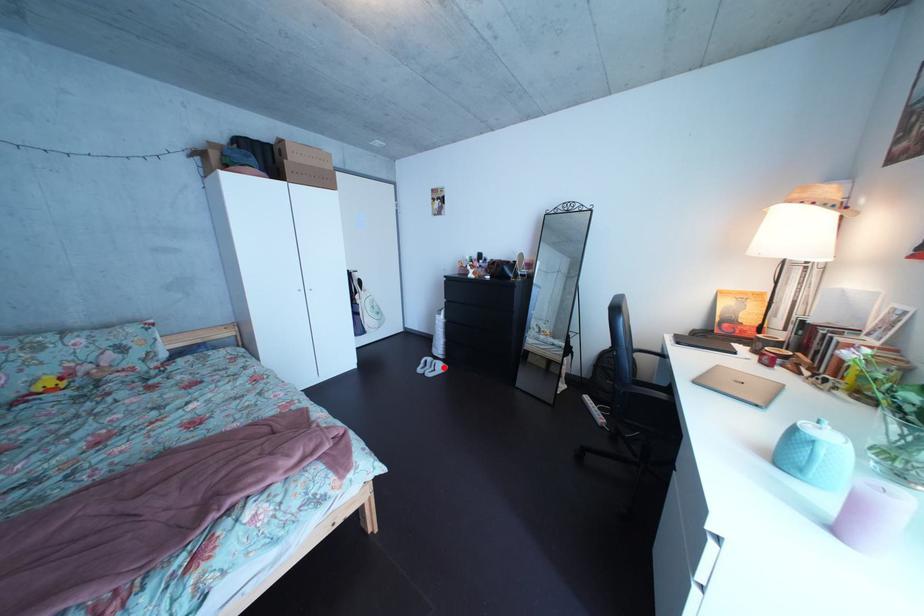
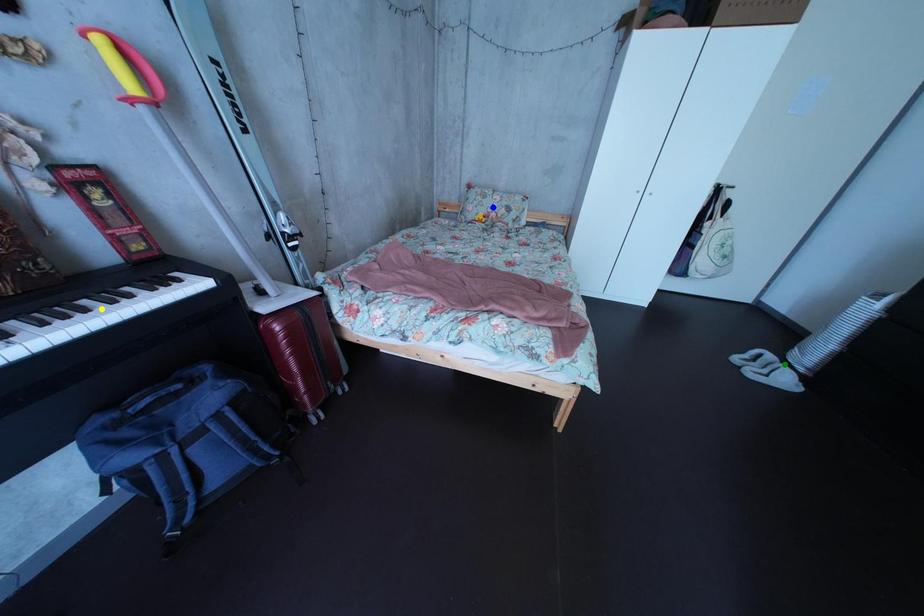
Question: I am providing you with two images of the same scene from different viewpoints. A red point is marked on the first image. You are given multiple points on the second image. Which mark in image 2 goes with the point in image 1?

Choices:
 (A) blue point
 (B) green point
 (C) yellow point

Answer: (B)